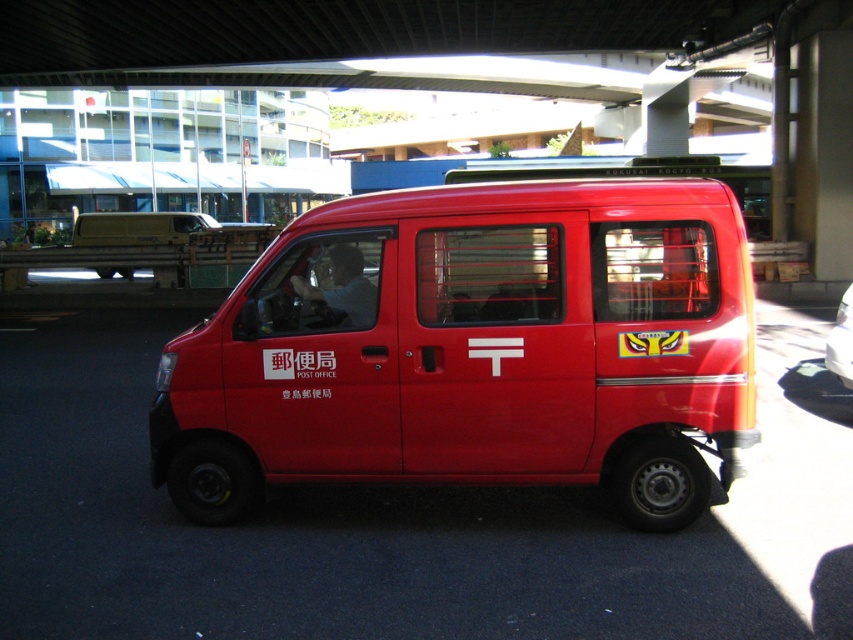
Is point (117, 225) in front of point (838, 307)?

That is False.

Which of these two, matte yellow van at left or metallic red van at center, stands shorter?

Standing shorter between the two is metallic red van at center.

Who is more forward, (132, 241) or (849, 308)?

Point (849, 308) is in front.

The width and height of the screenshot is (853, 640). I want to click on matte yellow van at left, so click(138, 228).

In the scene shown: Is matte red van at center closer to camera compared to metallic red van at center?

Yes, matte red van at center is in front of metallic red van at center.

This screenshot has width=853, height=640. Identify the location of matte red van at center. (474, 348).

This screenshot has width=853, height=640. In order to click on matte red van at center in this screenshot , I will do `click(474, 348)`.

Is matte red van at center wider than matte yellow van at left?

In fact, matte red van at center might be narrower than matte yellow van at left.

Which is in front, point (585, 196) or point (109, 269)?

Positioned in front is point (585, 196).

Does point (737, 364) come farther from viewer compared to point (167, 237)?

No, it is not.

You are a GUI agent. You are given a task and a screenshot of the screen. Output one action in this format:
    pyautogui.click(x=<x>, y=<y>)
    Task: Click on the matte red van at center
    
    Given the screenshot: What is the action you would take?
    pyautogui.click(x=474, y=348)